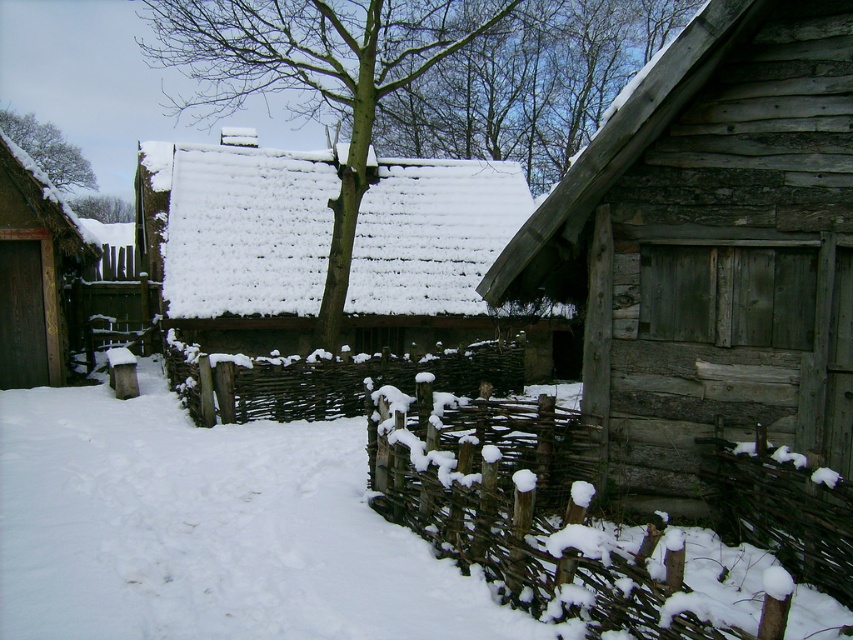
Question: Is weathered wood log cabin at right wider than wooden rustic fence at lower right?

Choices:
 (A) no
 (B) yes

Answer: (B)

Question: Estimate the real-world distances between objects in this image. Which object is farther from the snow-covered tree at upper left?

Choices:
 (A) brown wooden fence at lower right
 (B) snow-covered wooden cabin at center
 (C) green leafy tree at upper center
 (D) green textured tree at center

Answer: (A)

Question: Can you confirm if brown wooden fence at lower right is positioned below green leafy tree at upper center?

Choices:
 (A) yes
 (B) no

Answer: (A)

Question: Which of these objects is positioned farthest from the brown wooden fence at center?

Choices:
 (A) green leafy tree at upper center
 (B) weathered wood log cabin at right

Answer: (A)

Question: In this image, where is snow-covered wooden cabin at center located relative to dark brown wooden door at left?

Choices:
 (A) right
 (B) left

Answer: (A)

Question: Which of the following is the farthest from the observer?

Choices:
 (A) (126, 209)
 (B) (718, 522)
 (C) (517, 440)

Answer: (A)